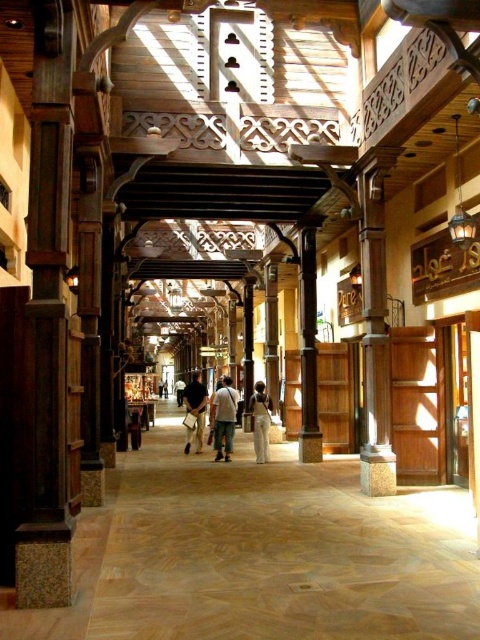
Is brown polished wood pillar at center shorter than dark brown leather jacket at center?

Yes.

Can you confirm if brown polished wood pillar at center is bigger than dark brown leather jacket at center?

Actually, brown polished wood pillar at center might be smaller than dark brown leather jacket at center.

Between point (300, 390) and point (197, 419), which one is positioned behind?

Positioned behind is point (197, 419).

Where is `brown polished wood pillar at center`? brown polished wood pillar at center is located at coordinates (309, 349).

Is point (363, 216) closer to camera compared to point (261, 380)?

That is True.

Is polished wood pillar at center taller than white cotton pants at center?

Correct, polished wood pillar at center is much taller as white cotton pants at center.

The image size is (480, 640). What do you see at coordinates (374, 330) in the screenshot? I see `polished wood pillar at center` at bounding box center [374, 330].

Image resolution: width=480 pixels, height=640 pixels. In order to click on polished wood pillar at center in this screenshot , I will do `click(374, 330)`.

Is light beige fabric pants at center further to camera compared to dark brown leather jacket at center?

No, light beige fabric pants at center is closer to the viewer.

Who is positioned more to the right, light beige fabric pants at center or dark brown leather jacket at center?

light beige fabric pants at center is more to the right.

Identify the location of light beige fabric pants at center. (224, 419).